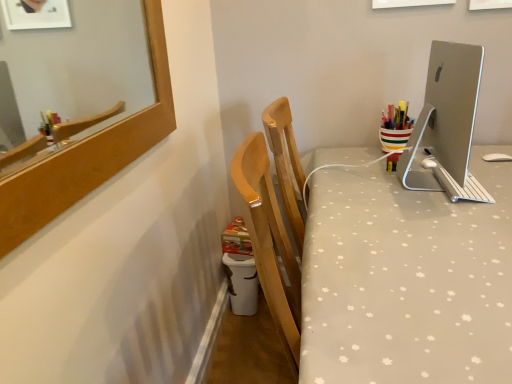
Where is `vacant area in front of silver metallic monitor at upper right`? This screenshot has width=512, height=384. vacant area in front of silver metallic monitor at upper right is located at coordinates (439, 227).